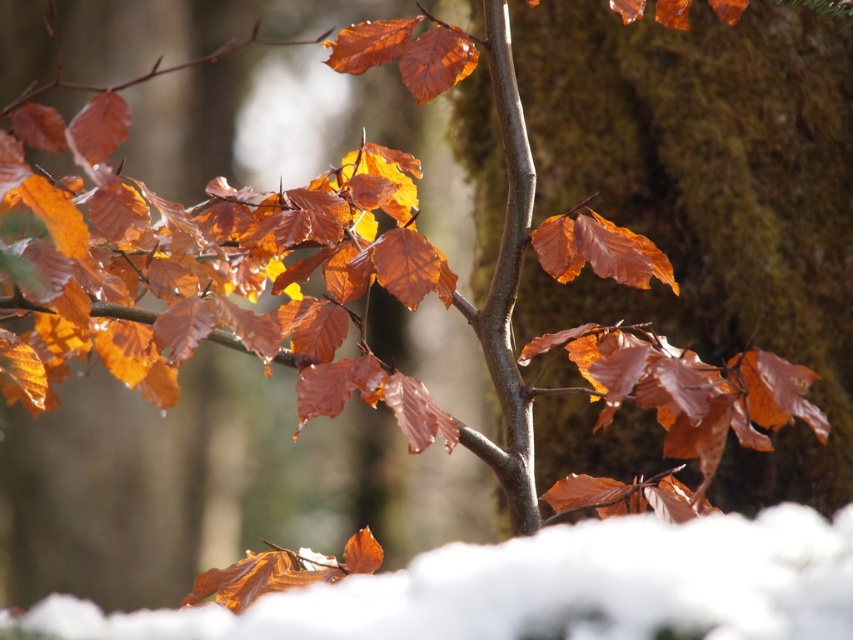
Based on the photo, does white fluffy snow at lower center have a larger size compared to smooth bark tree trunk at center?

Correct, white fluffy snow at lower center is larger in size than smooth bark tree trunk at center.

Which is in front, point (705, 627) or point (514, 442)?

Positioned in front is point (705, 627).

Image resolution: width=853 pixels, height=640 pixels. What are the coordinates of `white fluffy snow at lower center` in the screenshot? It's located at point(544,588).